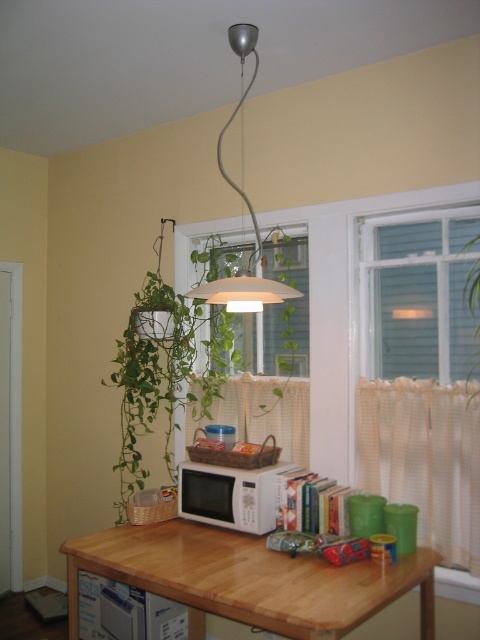
You are standing in the room and want to reach a point that is exactly 10 feet away from where you are currently standing. Is the point at coordinates point (120, 493) within that 10 feet range?

The distance of point (120, 493) from camera is 11.69 feet, which is beyond the 10 feet range, so the point is not within the desired distance.

Looking at this image, you are planning to place a large centerpiece on the wooden table at center. Considering the size of the metallic pendant light at center, will the centerpiece be visible from below the light?

The wooden table at center is bigger than the metallic pendant light at center, so the centerpiece placed on the table will likely be visible from below the light since the table has more space around it.